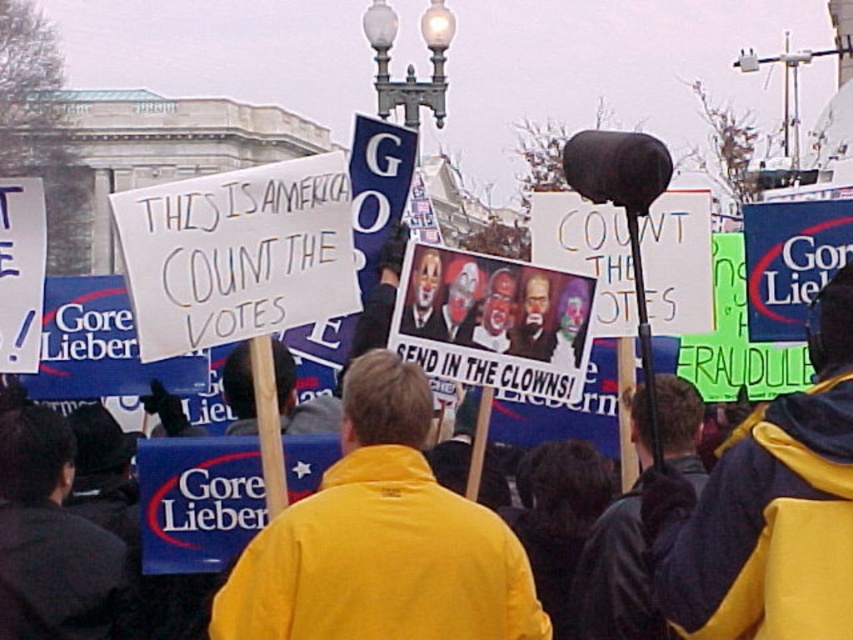
Question: Which object is closer to the camera taking this photo?

Choices:
 (A) yellow fabric jacket at lower right
 (B) yellow fabric jacket at center

Answer: (A)

Question: In this image, where is yellow fabric jacket at center located relative to yellow fabric jacket at lower right?

Choices:
 (A) below
 (B) above

Answer: (A)

Question: Which of the following is the farthest from the observer?

Choices:
 (A) yellow fabric jacket at lower right
 (B) yellow fabric jacket at center

Answer: (B)

Question: Does yellow fabric jacket at center have a smaller size compared to yellow fabric jacket at lower right?

Choices:
 (A) no
 (B) yes

Answer: (B)

Question: Does yellow fabric jacket at center come in front of yellow fabric jacket at lower right?

Choices:
 (A) yes
 (B) no

Answer: (B)